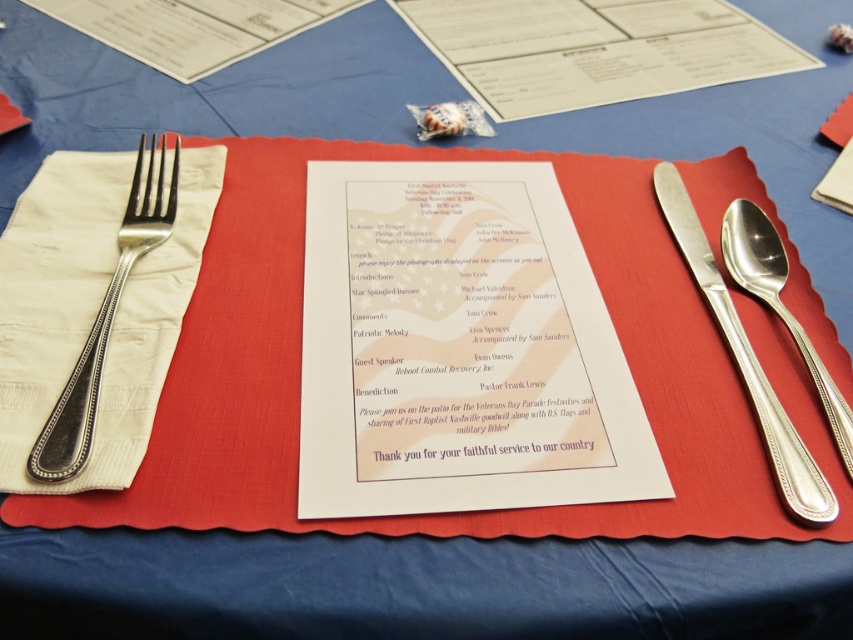
You are a guest at a formal dinner and need to choose between the silver polished fork at left and the silver metallic knife and spoon at right. According to the table setting, which one is more likely to be used for the main course?

The silver polished fork at left is positioned over the silver metallic knife and spoon at right, indicating it is the main course fork and should be used first.